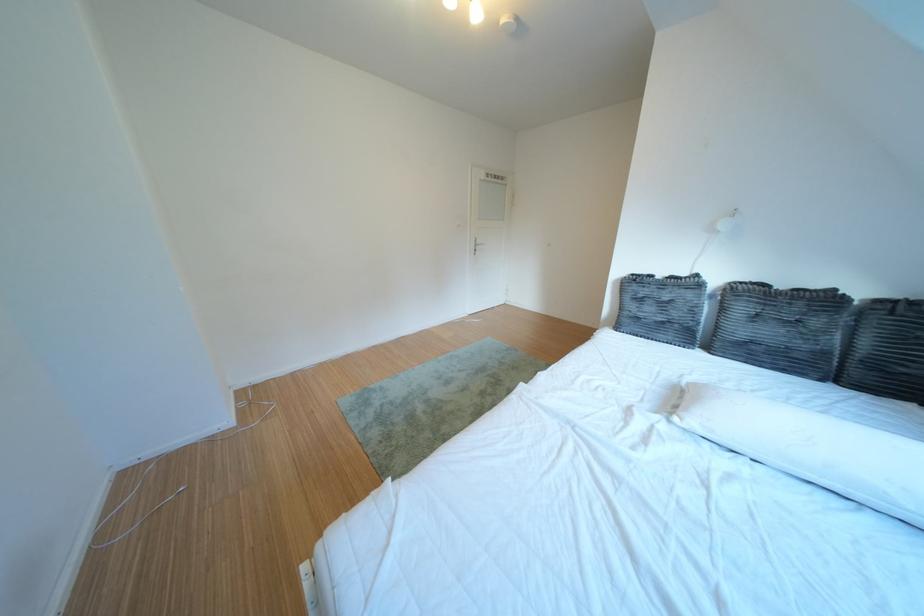
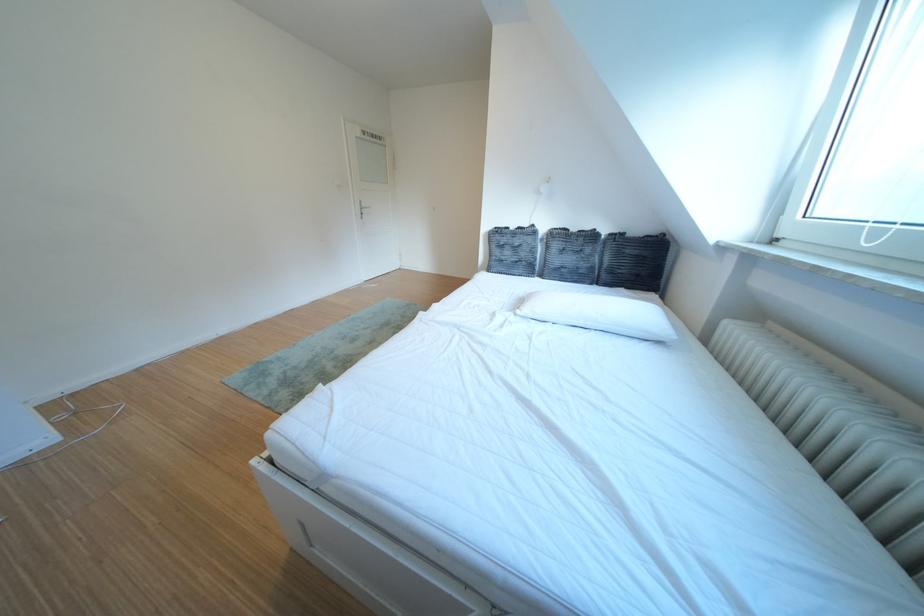
The point at (707,424) is marked in the first image. Where is the corresponding point in the second image?

(540, 314)